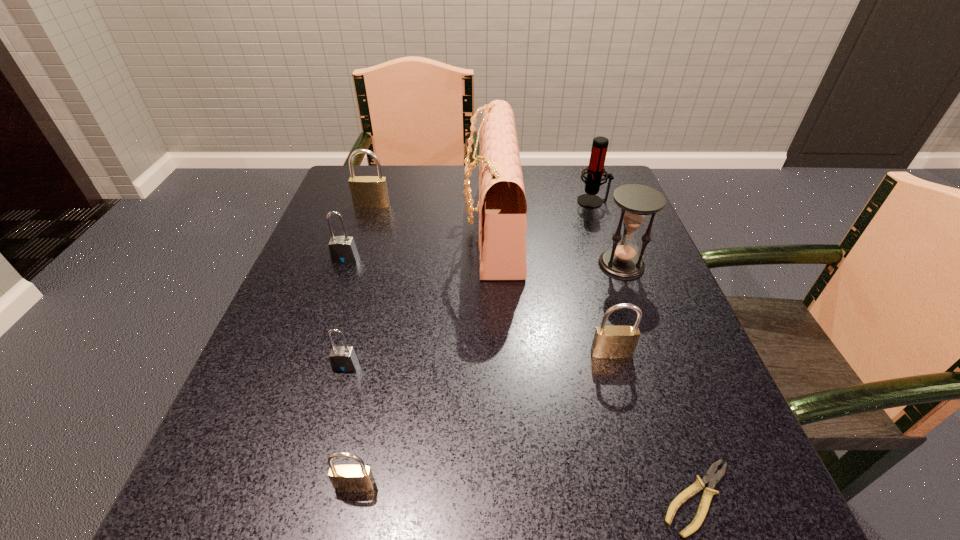
In the image, there is a desktop. What are the coordinates of `free space at the left edge` in the screenshot? It's located at (326, 392).

In the image, there is a desktop. Find the location of `vacant space at the right edge`. vacant space at the right edge is located at coordinates (627, 370).

Locate an element on the screen. free space at the far left corner of the desktop is located at coordinates (386, 167).

Identify the location of free region at the near left corner. Image resolution: width=960 pixels, height=540 pixels. (178, 533).

Where is `free space at the far right corner`? The image size is (960, 540). free space at the far right corner is located at coordinates (572, 175).

The height and width of the screenshot is (540, 960). What are the coordinates of `empty space that is in between the fourth nearest object and the tallest object` in the screenshot? It's located at (552, 291).

Locate an element on the screen. The image size is (960, 540). free spot between the left gray padlock and the second nearest padlock is located at coordinates (345, 312).

The height and width of the screenshot is (540, 960). I want to click on free space between the second nearest padlock and the fourth nearest object, so click(x=478, y=359).

The width and height of the screenshot is (960, 540). I want to click on vacant area that lies between the fourth nearest padlock and the farthest padlock, so click(358, 232).

Find the location of a particular element. The image size is (960, 540). vacant point located between the red microphone and the smallest brass padlock is located at coordinates (474, 343).